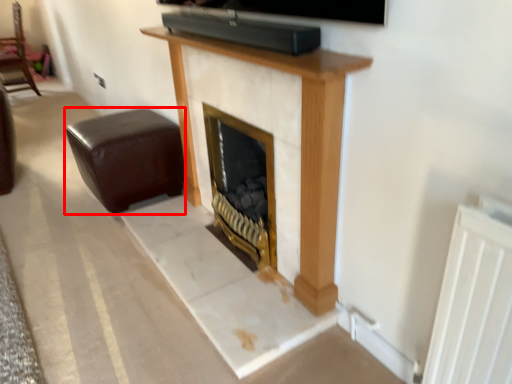
Question: From the image's perspective, considering the relative positions of furniture (annotated by the red box) and furniture in the image provided, where is furniture (annotated by the red box) located with respect to the staircase?

Choices:
 (A) above
 (B) below

Answer: (B)